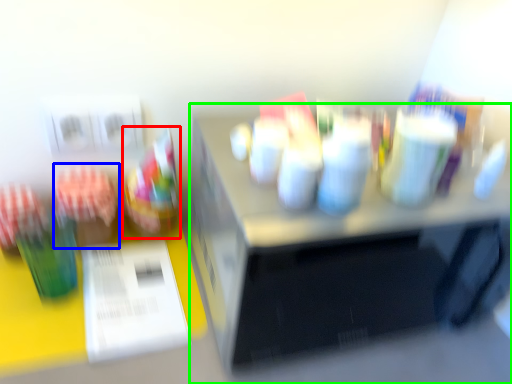
Question: Estimate the real-world distances between objects in this image. Which object is farther from food (highlighted by a red box), stationery (highlighted by a blue box) or desk (highlighted by a green box)?

Choices:
 (A) stationery
 (B) desk

Answer: (B)